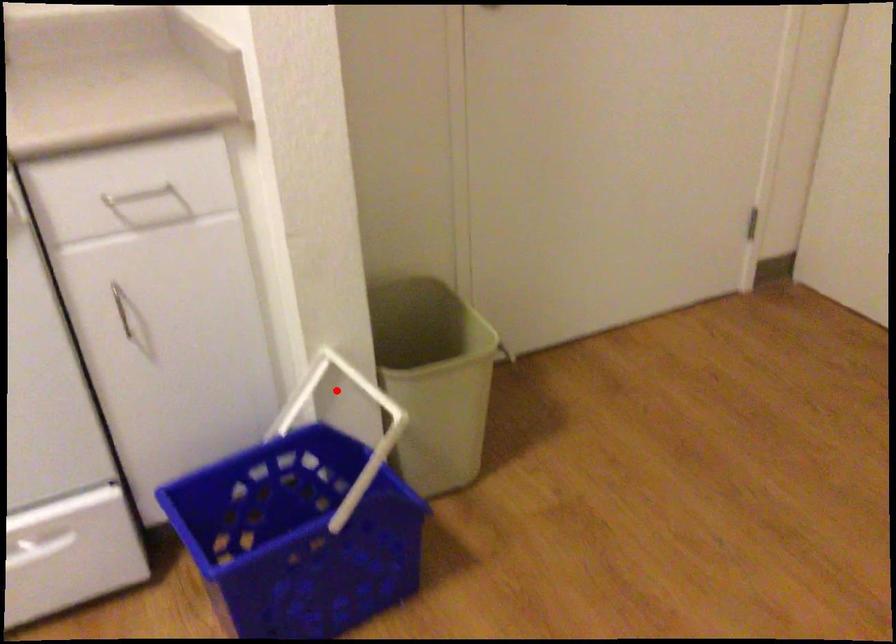
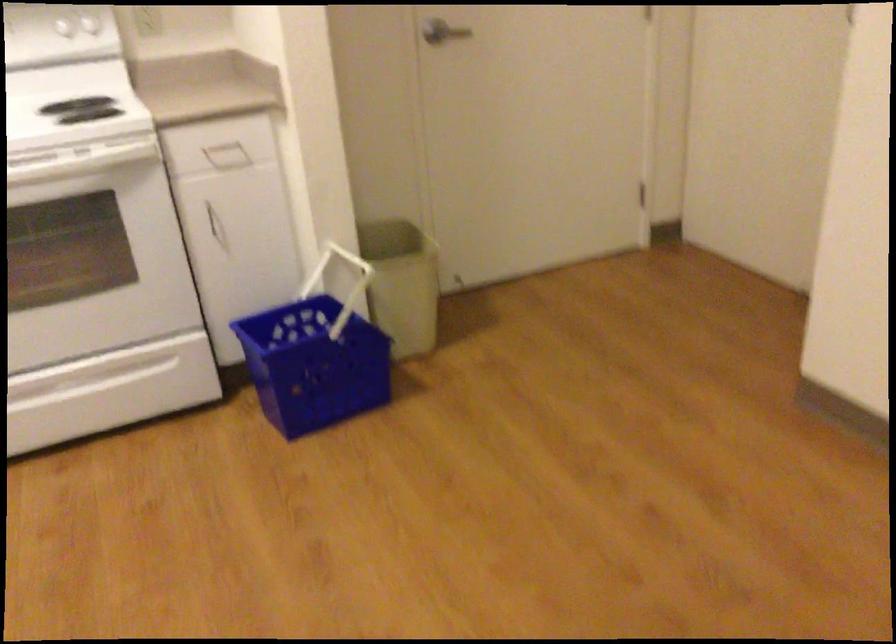
Where in the second image is the point corresponding to the highlighted location from the first image?

(337, 272)